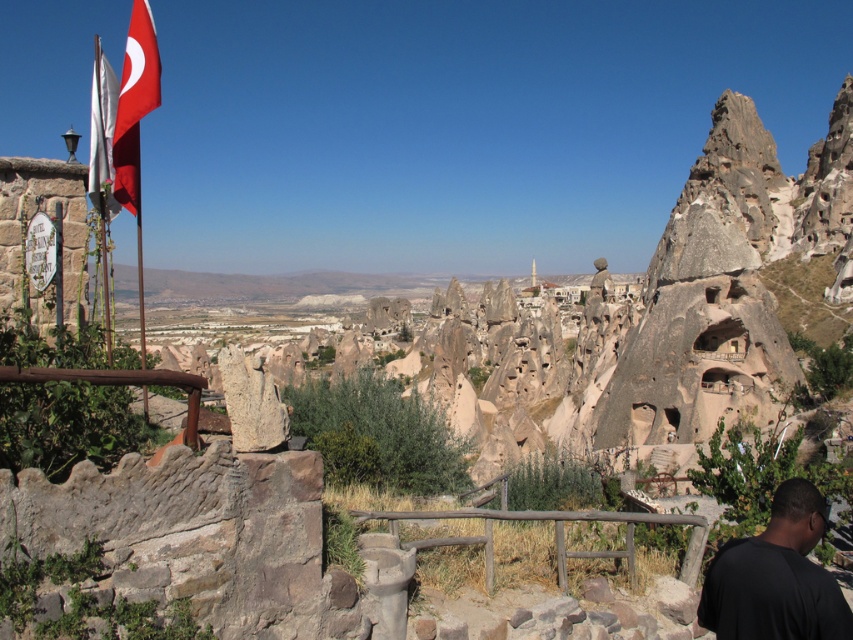
Is point (735, 556) closer to camera compared to point (157, 104)?

Yes, point (735, 556) is closer to viewer.

Measure the distance between black matte shirt at lower right and camera.

black matte shirt at lower right and camera are 43.81 meters apart.

The image size is (853, 640). Describe the element at coordinates (776, 577) in the screenshot. I see `black matte shirt at lower right` at that location.

At what (x,y) coordinates should I click in order to perform the action: click on black matte shirt at lower right. Please return your answer as a coordinate pair (x, y). Looking at the image, I should click on (776, 577).

Does black matte shirt at lower right have a greater height compared to brown wooden rail at center?

Correct, black matte shirt at lower right is much taller as brown wooden rail at center.

Describe the element at coordinates (776, 577) in the screenshot. I see `black matte shirt at lower right` at that location.

The height and width of the screenshot is (640, 853). Describe the element at coordinates (776, 577) in the screenshot. I see `black matte shirt at lower right` at that location.

At what (x,y) coordinates should I click in order to perform the action: click on black matte shirt at lower right. Please return your answer as a coordinate pair (x, y). Image resolution: width=853 pixels, height=640 pixels. Looking at the image, I should click on (776, 577).

Can you confirm if red fabric flag at upper left is smaller than white fabric flag at left?

Yes.

Is red fabric flag at upper left to the right of white fabric flag at left from the viewer's perspective?

Correct, you'll find red fabric flag at upper left to the right of white fabric flag at left.

This screenshot has height=640, width=853. What are the coordinates of `red fabric flag at upper left` in the screenshot? It's located at (134, 104).